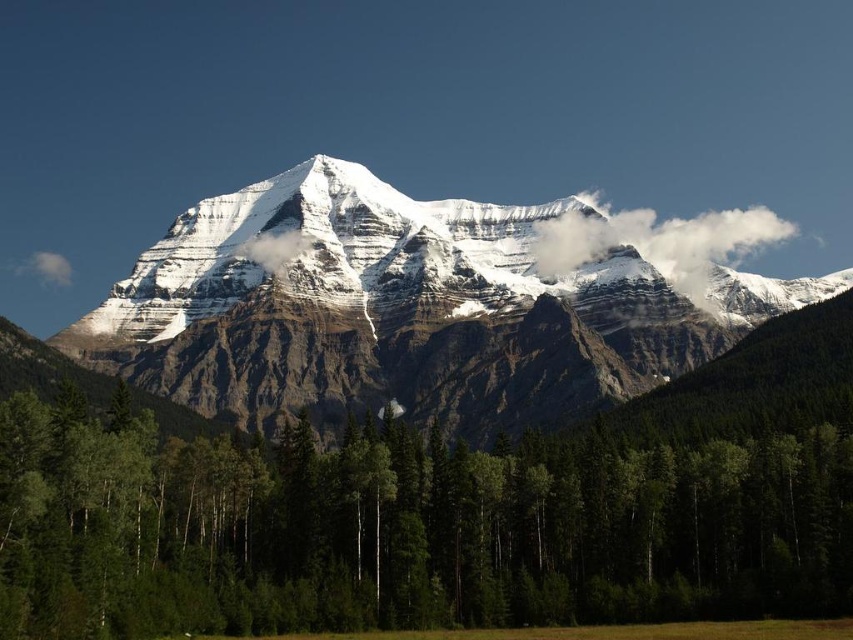
You are a hiker standing at the base of the mountain. You see the green matte tree at center and the white fluffy cloud at upper right. Which object is higher up in the scene?

The white fluffy cloud at upper right is higher up in the scene than the green matte tree at center because the green matte tree at center is located below it.

You are planning to take a photo of the green matte tree at center and the white fluffy cloud at upper right. Which object should you focus on first if you want both to be in sharp focus?

The green matte tree at center is closer than the white fluffy cloud at upper right, so you should focus on the green matte tree at center first to ensure both are in sharp focus.

Consider the image. You are a hiker planning to take a photo of the snowy granite mountain range at center from the base of the green matte tree at center. Will the tree block your view of the mountain?

The green matte tree at center is not as tall as the snowy granite mountain range at center, so the tree will not block your view of the mountain.